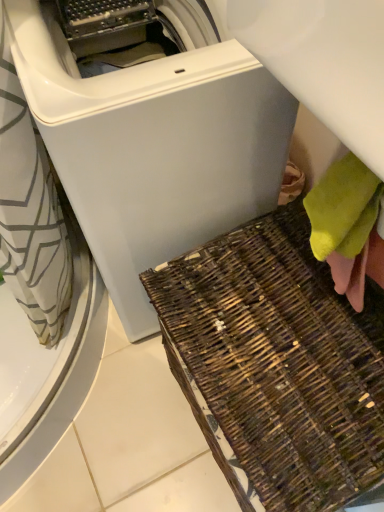
Question: Is white matte washing machine at center taller than brown woven basket at lower right?

Choices:
 (A) yes
 (B) no

Answer: (A)

Question: Can you confirm if white matte washing machine at center is positioned to the left of brown woven basket at lower right?

Choices:
 (A) yes
 (B) no

Answer: (A)

Question: Is white matte washing machine at center positioned far away from brown woven basket at lower right?

Choices:
 (A) no
 (B) yes

Answer: (A)

Question: From the image's perspective, is white matte washing machine at center below brown woven basket at lower right?

Choices:
 (A) yes
 (B) no

Answer: (B)

Question: Is white matte washing machine at center oriented away from brown woven basket at lower right?

Choices:
 (A) no
 (B) yes

Answer: (A)

Question: Does white matte washing machine at center have a smaller size compared to brown woven basket at lower right?

Choices:
 (A) no
 (B) yes

Answer: (A)

Question: From a real-world perspective, does white matte washing machine at center stand above soft yellow towel at lower right?

Choices:
 (A) yes
 (B) no

Answer: (B)

Question: Does white matte washing machine at center have a larger size compared to soft yellow towel at lower right?

Choices:
 (A) yes
 (B) no

Answer: (A)

Question: From the image's perspective, is white matte washing machine at center located above soft yellow towel at lower right?

Choices:
 (A) yes
 (B) no

Answer: (A)

Question: Is white matte washing machine at center smaller than soft yellow towel at lower right?

Choices:
 (A) no
 (B) yes

Answer: (A)

Question: Is white matte washing machine at center next to soft yellow towel at lower right and touching it?

Choices:
 (A) yes
 (B) no

Answer: (B)

Question: Is white matte washing machine at center looking in the opposite direction of soft yellow towel at lower right?

Choices:
 (A) no
 (B) yes

Answer: (A)

Question: Does soft yellow towel at lower right have a greater height compared to brown woven basket at lower right?

Choices:
 (A) yes
 (B) no

Answer: (B)